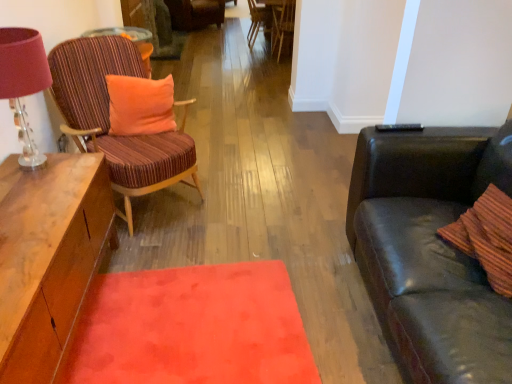
Image resolution: width=512 pixels, height=384 pixels. I want to click on free spot to the right of striped fabric chair at left, the 1th chair in the bottom-to-top sequence, so click(241, 202).